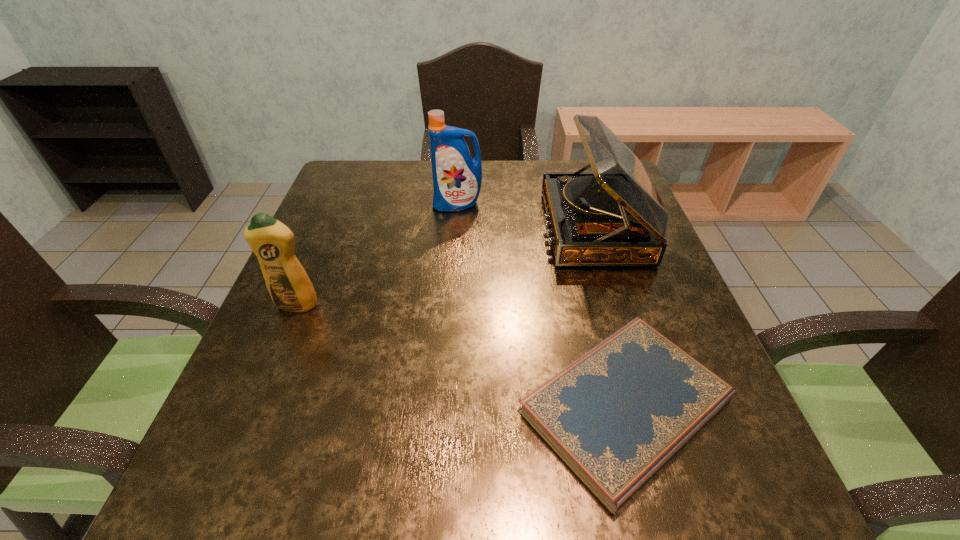
The image size is (960, 540). I want to click on the third object from right to left, so click(x=457, y=178).

Where is `the right detergent`? the right detergent is located at coordinates (457, 178).

Image resolution: width=960 pixels, height=540 pixels. In order to click on record player in this screenshot , I will do `click(614, 216)`.

Locate an element on the screen. The width and height of the screenshot is (960, 540). the leftmost object is located at coordinates (289, 286).

Where is `the left detergent`? This screenshot has width=960, height=540. the left detergent is located at coordinates (289, 286).

You are a GUI agent. You are given a task and a screenshot of the screen. Output one action in this format:
    pyautogui.click(x=<x>, y=<y>)
    Task: Click on the paperback book
    The image size is (960, 540).
    Given the screenshot: What is the action you would take?
    click(615, 416)

Where is `the nearest object`? the nearest object is located at coordinates (615, 416).

This screenshot has width=960, height=540. What are the coordinates of `vacant point located 0.120m on the label of the right detergent` in the screenshot? It's located at (455, 240).

This screenshot has width=960, height=540. What are the coordinates of `vacant space located on the front-facing side of the record player` in the screenshot? It's located at (444, 227).

You are a GUI agent. You are given a task and a screenshot of the screen. Output one action in this format:
    pyautogui.click(x=<x>, y=<y>)
    Task: Click on the vacant space located 0.160m on the front-facing side of the record player
    
    Given the screenshot: What is the action you would take?
    pyautogui.click(x=480, y=227)